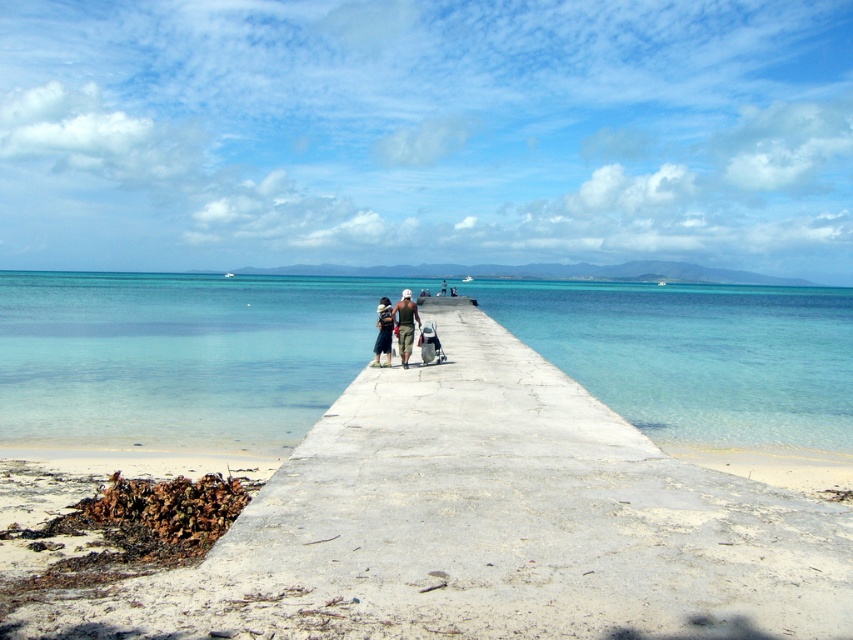
Question: Which object is farther from the camera taking this photo?

Choices:
 (A) concrete at center
 (B) matte khaki shorts at center
 (C) clear blue water at center
 (D) dark green fabric bag at center

Answer: (D)

Question: Which of the following is the closest to the observer?

Choices:
 (A) clear blue water at center
 (B) matte khaki shorts at center
 (C) dark green fabric bag at center
 (D) concrete at center

Answer: (D)

Question: Is concrete at center above clear blue water at center?

Choices:
 (A) yes
 (B) no

Answer: (B)

Question: Does clear blue water at center appear over dark green fabric bag at center?

Choices:
 (A) yes
 (B) no

Answer: (A)

Question: Does clear blue water at center have a greater width compared to dark green fabric bag at center?

Choices:
 (A) yes
 (B) no

Answer: (A)

Question: Which object is farther from the camera taking this photo?

Choices:
 (A) concrete at center
 (B) matte khaki shorts at center

Answer: (B)